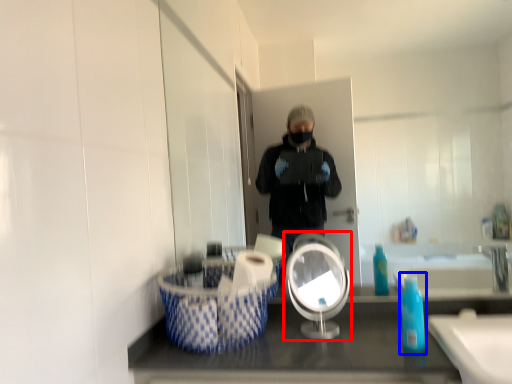
Question: Which object is further to the camera taking this photo, mirror (highlighted by a red box) or soap dispenser (highlighted by a blue box)?

Choices:
 (A) mirror
 (B) soap dispenser

Answer: (A)